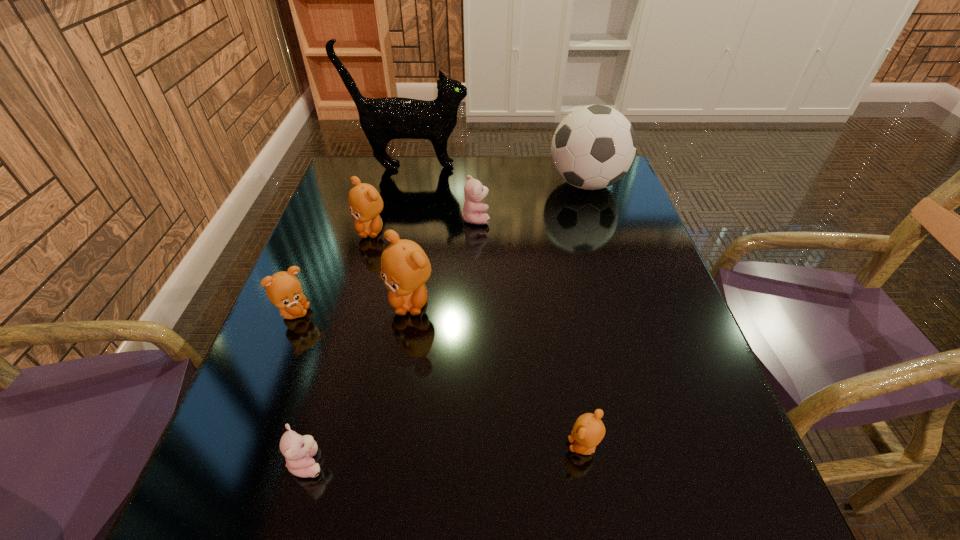
Identify which teddy bear is the second closest to the right pink teddy bear. Please provide its 2D coordinates. Your answer should be formatted as a tuple, i.e. [(x, y)], where the tuple contains the x and y coordinates of a point satisfying the conditions above.

[(405, 268)]

Identify which brown teddy bear is the third closest to the nearer pink teddy bear. Please provide its 2D coordinates. Your answer should be formatted as a tuple, i.e. [(x, y)], where the tuple contains the x and y coordinates of a point satisfying the conditions above.

[(588, 431)]

The width and height of the screenshot is (960, 540). I want to click on the closest brown teddy bear to the farther pink teddy bear, so point(365,203).

This screenshot has width=960, height=540. In order to click on free space that satisfies the following two spatial constraints: 1. on the front side of the rightmost object; 2. at the face of the fifth teddy bear from left to right in this screenshot , I will do `click(597, 218)`.

Locate an element on the screen. Image resolution: width=960 pixels, height=540 pixels. free space that satisfies the following two spatial constraints: 1. on the face of the third tallest object; 2. on the face of the leftmost teddy bear is located at coordinates (409, 313).